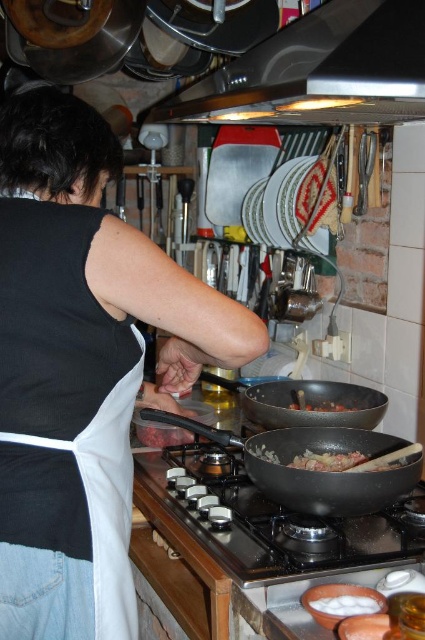
Does black matte exhaust hood at upper center lie behind white fluffy food at lower center?

No, black matte exhaust hood at upper center is in front of white fluffy food at lower center.

Find the location of `black matte exhaust hood at upper center`. black matte exhaust hood at upper center is located at coordinates (317, 72).

Is shiny black wok at center taller than white fluffy food at lower center?

Indeed, shiny black wok at center has a greater height compared to white fluffy food at lower center.

Is point (357, 387) positioned behind point (319, 600)?

Yes, it is.

Between point (331, 397) and point (337, 611), which one is positioned behind?

The point (331, 397) is more distant.

Where is `shiny black wok at center`? The height and width of the screenshot is (640, 425). shiny black wok at center is located at coordinates (305, 401).

Between black matte apron at upper left and black matte gas stove at center, which one appears on the left side from the viewer's perspective?

black matte apron at upper left is more to the left.

Can you confirm if black matte apron at upper left is positioned to the right of black matte gas stove at center?

In fact, black matte apron at upper left is to the left of black matte gas stove at center.

The height and width of the screenshot is (640, 425). Identify the location of black matte apron at upper left. (79, 368).

The image size is (425, 640). I want to click on black matte apron at upper left, so click(79, 368).